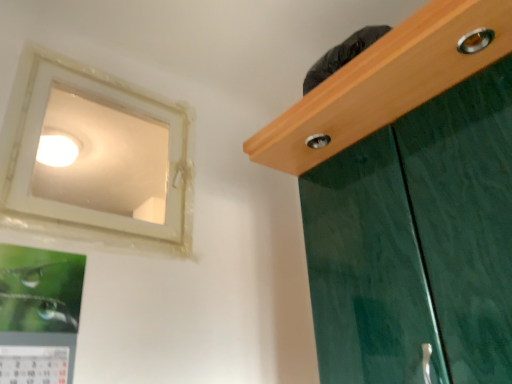
You are a GUI agent. You are given a task and a screenshot of the screen. Output one action in this format:
    pyautogui.click(x=<x>, y=<y>)
    Task: Click on the vacant space situated above white plastic window at upper left (from a real-world perspective)
    The height and width of the screenshot is (384, 512).
    Given the screenshot: What is the action you would take?
    pyautogui.click(x=98, y=62)